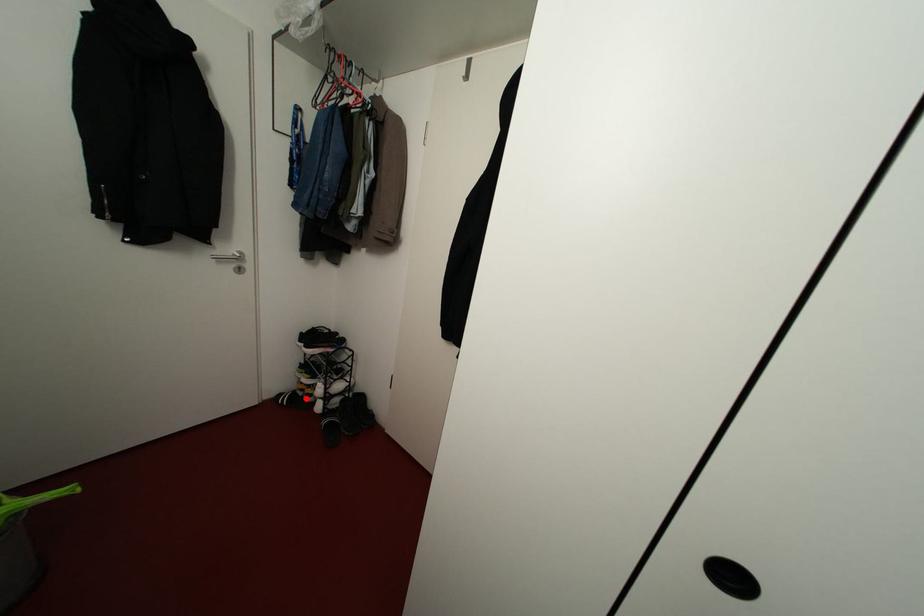
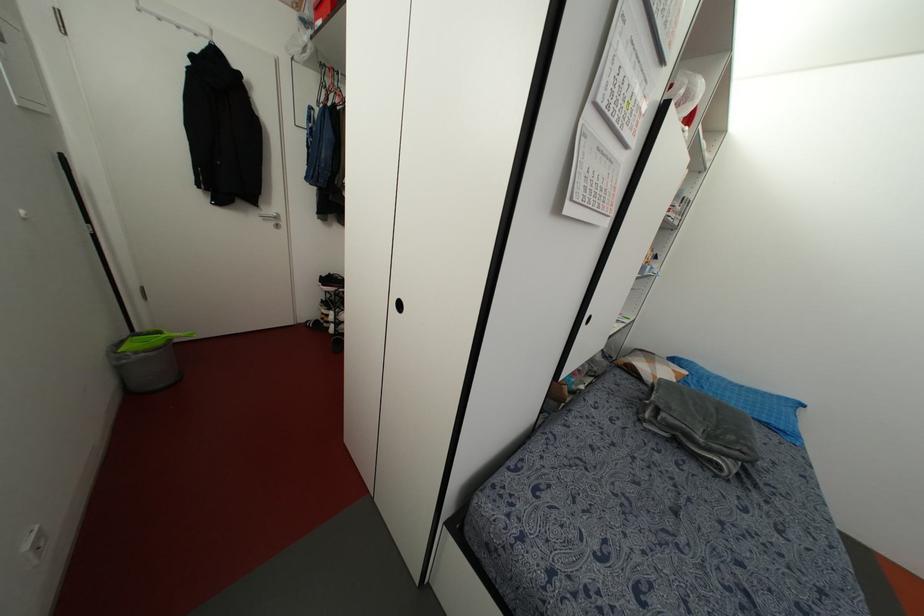
Locate, in the second image, the point that corresponds to the highlighted location in the first image.

(324, 323)